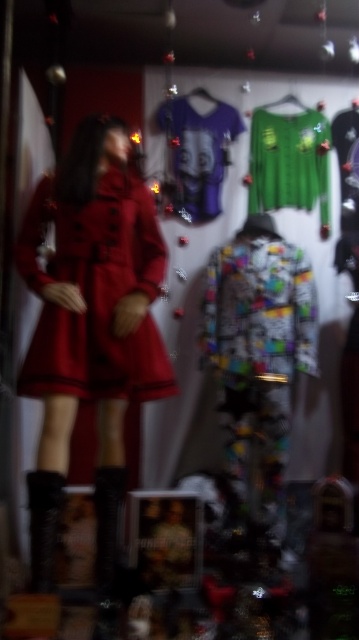
Question: Can you confirm if green matte sweater at upper center is smaller than purple jersey at center?

Choices:
 (A) no
 (B) yes

Answer: (B)

Question: Can you confirm if matte red coat at center is wider than purple jersey at center?

Choices:
 (A) yes
 (B) no

Answer: (A)

Question: Is matte red coat at center bigger than purple jersey at center?

Choices:
 (A) yes
 (B) no

Answer: (A)

Question: Which point is farther from the camera taking this photo?

Choices:
 (A) (220, 154)
 (B) (100, 356)

Answer: (A)

Question: Which of these objects is positioned farthest from the matte red coat at center?

Choices:
 (A) green matte sweater at upper center
 (B) purple jersey at center

Answer: (A)

Question: Among these points, which one is farthest from the camera?

Choices:
 (A) (282, 129)
 (B) (206, 147)

Answer: (A)